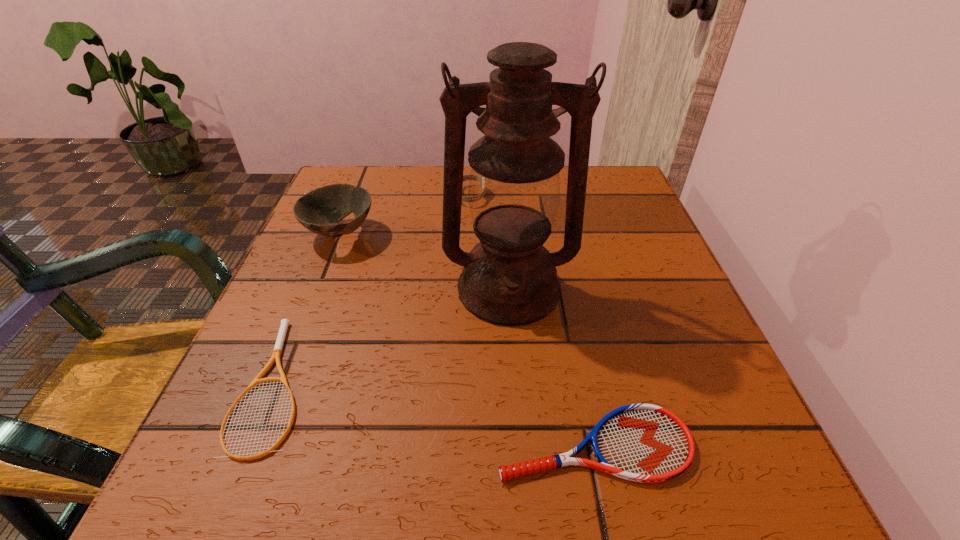
At what (x,y) coordinates should I click in order to perform the action: click on free region located 0.340m on the face of the farthest object. Please return your answer as a coordinate pair (x, y). The image size is (960, 540). Looking at the image, I should click on (631, 195).

What are the coordinates of `vacant space located on the left of the second shortest object` in the screenshot? It's located at (208, 444).

This screenshot has height=540, width=960. What are the coordinates of `free space located 0.380m on the back of the left tennis racket` in the screenshot? It's located at (350, 201).

You are a GUI agent. You are given a task and a screenshot of the screen. Output one action in this format:
    pyautogui.click(x=<x>, y=<y>)
    Task: Click on the bowl that is at the far edge
    
    Given the screenshot: What is the action you would take?
    pyautogui.click(x=320, y=210)

Locate an element on the screen. The width and height of the screenshot is (960, 540). watch at the far edge is located at coordinates (x=465, y=177).

Locate an element on the screen. This screenshot has width=960, height=540. bowl located in the left edge section of the desktop is located at coordinates (320, 210).

This screenshot has height=540, width=960. Identify the location of tennis racket that is positioned at the left edge. (277, 351).

The image size is (960, 540). Identify the location of object situated at the right edge. (646, 443).

Find the location of a particular element. This screenshot has height=540, width=960. object located at the far left corner is located at coordinates click(320, 210).

Where is `object positioned at the near left corner`? The width and height of the screenshot is (960, 540). object positioned at the near left corner is located at coordinates (277, 351).